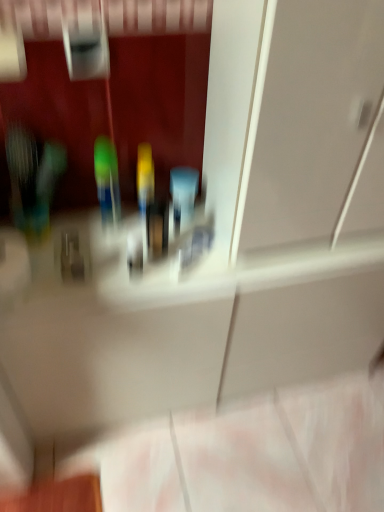
Question: Is transparent glass door at upper center shorter than green plastic toothbrush at center?

Choices:
 (A) yes
 (B) no

Answer: (B)

Question: From a real-world perspective, is transparent glass door at upper center physically below green plastic toothbrush at center?

Choices:
 (A) yes
 (B) no

Answer: (B)

Question: Is transparent glass door at upper center oriented towards green plastic toothbrush at center?

Choices:
 (A) yes
 (B) no

Answer: (B)

Question: Considering the relative sizes of transparent glass door at upper center and green plastic toothbrush at center in the image provided, is transparent glass door at upper center wider than green plastic toothbrush at center?

Choices:
 (A) yes
 (B) no

Answer: (A)

Question: Is green plastic toothbrush at center a part of transparent glass door at upper center?

Choices:
 (A) no
 (B) yes

Answer: (A)

Question: Is transparent glass door at upper center not close to green plastic toothbrush at center?

Choices:
 (A) yes
 (B) no

Answer: (B)

Question: Can you confirm if green plastic toothbrush at center is positioned to the left of transparent glass door at upper center?

Choices:
 (A) yes
 (B) no

Answer: (A)

Question: Is green plastic toothbrush at center facing towards transparent glass door at upper center?

Choices:
 (A) no
 (B) yes

Answer: (A)

Question: Is green plastic toothbrush at center not near transparent glass door at upper center?

Choices:
 (A) yes
 (B) no

Answer: (B)

Question: Is green plastic toothbrush at center bigger than transparent glass door at upper center?

Choices:
 (A) yes
 (B) no

Answer: (B)

Question: From the image's perspective, would you say green plastic toothbrush at center is positioned over transparent glass door at upper center?

Choices:
 (A) no
 (B) yes

Answer: (A)

Question: Considering the relative positions of green plastic toothbrush at center and transparent glass door at upper center in the image provided, is green plastic toothbrush at center to the right of transparent glass door at upper center from the viewer's perspective?

Choices:
 (A) yes
 (B) no

Answer: (B)

Question: From a real-world perspective, is transparent glass door at upper center physically located above or below green plastic toothbrush at center?

Choices:
 (A) above
 (B) below

Answer: (A)